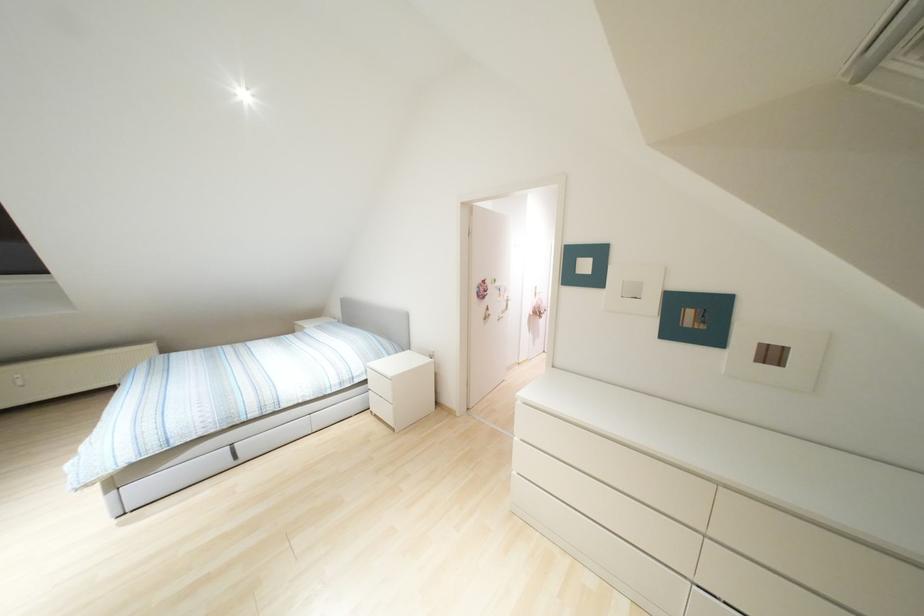
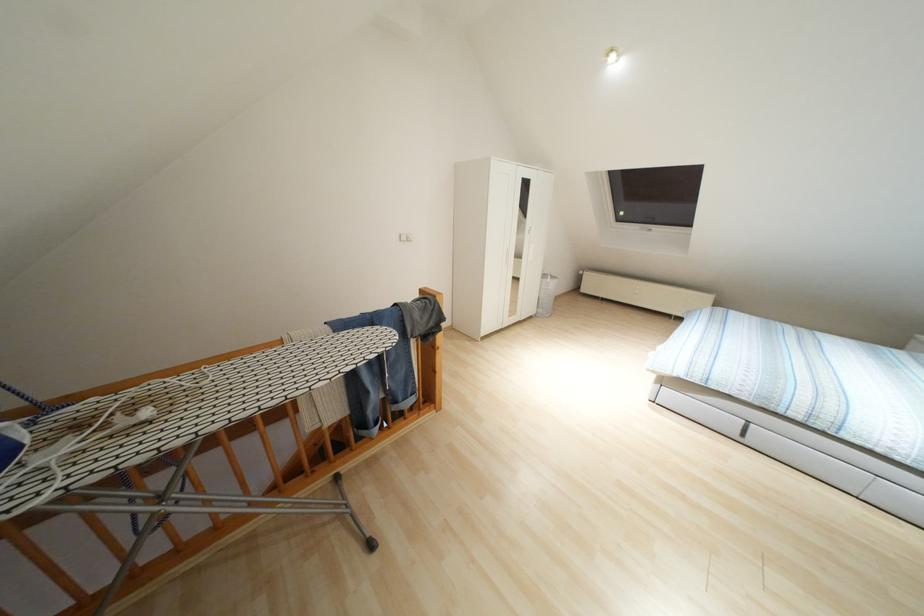
The first image is from the beginning of the video and the second image is from the end. How did the camera likely rotate when shooting the video?

The camera's rotation is toward left-down.